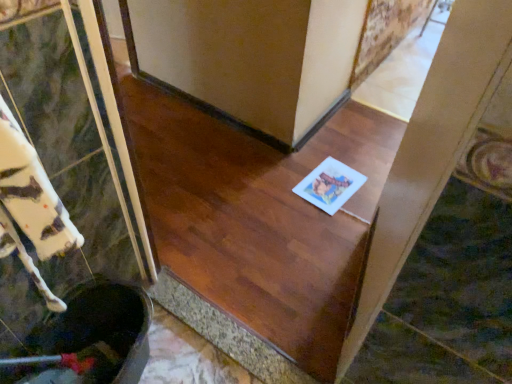
Where is `free space to the left of white paper at center`? The image size is (512, 384). free space to the left of white paper at center is located at coordinates (281, 180).